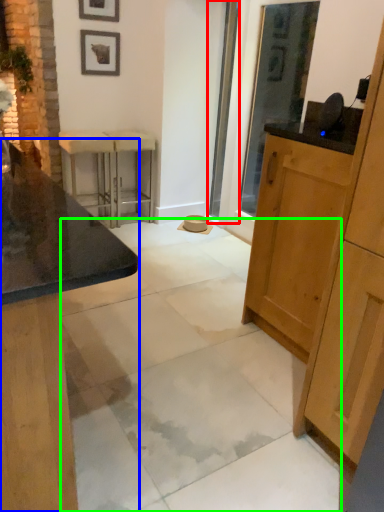
Question: Based on their relative distances, which object is nearer to screen door (highlighted by a red box)? Choose from cabinetry (highlighted by a blue box) and concrete (highlighted by a green box).

Choices:
 (A) cabinetry
 (B) concrete

Answer: (B)